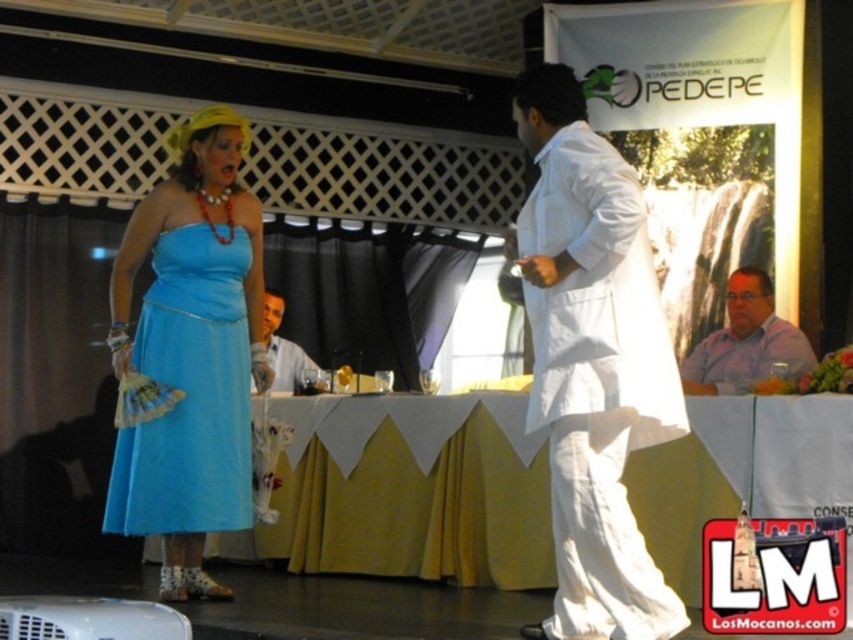
Question: Which point is closer to the camera taking this photo?

Choices:
 (A) (697, 381)
 (B) (279, 310)

Answer: (A)

Question: Does white cotton robe at center have a larger size compared to matte blue dress at center?

Choices:
 (A) no
 (B) yes

Answer: (B)

Question: Which point appears closest to the camera in this image?

Choices:
 (A) (619, 324)
 (B) (196, 257)
 (C) (808, 358)
 (D) (271, 292)

Answer: (A)

Question: Which point appears closest to the camera in this image?

Choices:
 (A) (734, 296)
 (B) (218, 516)

Answer: (B)

Question: Is purple shirt at center closer to the viewer compared to matte white shirt at center?

Choices:
 (A) yes
 (B) no

Answer: (A)

Question: Can you confirm if matte blue dress at center is positioned to the left of purple shirt at center?

Choices:
 (A) yes
 (B) no

Answer: (A)